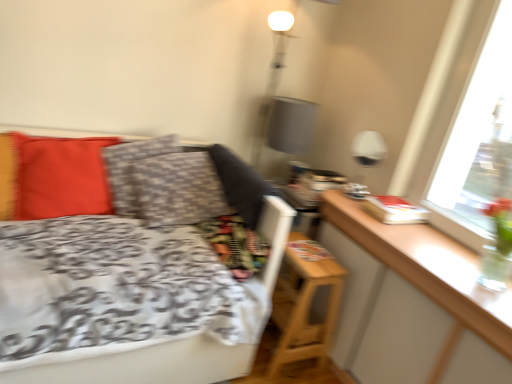
Question: From the image's perspective, does wooden table at right appear higher than patterned fabric pillow at center, which appears as the 1th pillow when viewed from the right?

Choices:
 (A) no
 (B) yes

Answer: (A)

Question: From a real-world perspective, is wooden table at right below patterned fabric pillow at center, acting as the 2th pillow starting from the left?

Choices:
 (A) yes
 (B) no

Answer: (B)

Question: From a real-world perspective, is wooden table at right located higher than patterned fabric pillow at center, acting as the 2th pillow starting from the left?

Choices:
 (A) yes
 (B) no

Answer: (A)

Question: Is wooden table at right smaller than patterned fabric pillow at center, which appears as the 1th pillow when viewed from the right?

Choices:
 (A) no
 (B) yes

Answer: (B)

Question: Is wooden table at right looking in the opposite direction of patterned fabric pillow at center, acting as the 2th pillow starting from the left?

Choices:
 (A) no
 (B) yes

Answer: (A)

Question: Could you tell me if wooden table at right is turned towards patterned fabric pillow at center, which appears as the 1th pillow when viewed from the right?

Choices:
 (A) yes
 (B) no

Answer: (A)

Question: Considering the relative sizes of white glossy table lamp at upper right and matte red pillow at left, the first pillow viewed from the left, in the image provided, is white glossy table lamp at upper right thinner than matte red pillow at left, the first pillow viewed from the left,?

Choices:
 (A) yes
 (B) no

Answer: (A)

Question: Is white glossy table lamp at upper right to the right of matte red pillow at left, which is counted as the 2th pillow, starting from the right, from the viewer's perspective?

Choices:
 (A) yes
 (B) no

Answer: (A)

Question: Can you confirm if white glossy table lamp at upper right is wider than matte red pillow at left, which is counted as the 2th pillow, starting from the right?

Choices:
 (A) yes
 (B) no

Answer: (B)

Question: Is white glossy table lamp at upper right oriented away from matte red pillow at left, which is counted as the 2th pillow, starting from the right?

Choices:
 (A) no
 (B) yes

Answer: (A)

Question: Are white glossy table lamp at upper right and matte red pillow at left, the first pillow viewed from the left, beside each other?

Choices:
 (A) yes
 (B) no

Answer: (B)

Question: Is white glossy table lamp at upper right smaller than matte red pillow at left, which is counted as the 2th pillow, starting from the right?

Choices:
 (A) yes
 (B) no

Answer: (A)

Question: Considering the relative sizes of white glossy table lamp at upper right and wooden table at right in the image provided, is white glossy table lamp at upper right bigger than wooden table at right?

Choices:
 (A) yes
 (B) no

Answer: (B)